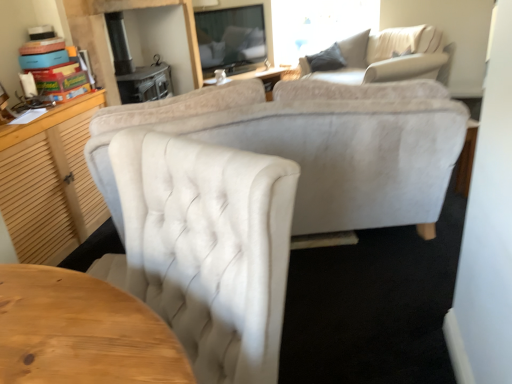
The image size is (512, 384). What do you see at coordinates (386, 56) in the screenshot?
I see `velvet beige sofa at upper right` at bounding box center [386, 56].

The image size is (512, 384). In order to click on velvet beige sofa at upper right in this screenshot , I will do `click(386, 56)`.

The height and width of the screenshot is (384, 512). What do you see at coordinates (206, 247) in the screenshot? I see `velvet white chair at center` at bounding box center [206, 247].

I want to click on velvet white chair at center, so pos(206,247).

Where is `velvet beige sofa at upper right`? This screenshot has width=512, height=384. velvet beige sofa at upper right is located at coordinates (386, 56).

Which is more to the left, velvet beige sofa at upper right or velvet white chair at center?

From the viewer's perspective, velvet white chair at center appears more on the left side.

From the picture: Does velvet beige sofa at upper right come in front of velvet white chair at center?

No, velvet beige sofa at upper right is further to the viewer.

Between point (349, 39) and point (268, 359), which one is positioned behind?

Positioned behind is point (349, 39).

From the image's perspective, which one is positioned higher, velvet beige sofa at upper right or velvet white chair at center?

velvet beige sofa at upper right is shown above in the image.

From a real-world perspective, between velvet beige sofa at upper right and velvet white chair at center, who is vertically higher?

velvet white chair at center.

Is velvet beige sofa at upper right thinner than velvet white chair at center?

No.

Can you confirm if velvet beige sofa at upper right is taller than velvet white chair at center?

In fact, velvet beige sofa at upper right may be shorter than velvet white chair at center.

Considering the sizes of velvet beige sofa at upper right and velvet white chair at center in the image, is velvet beige sofa at upper right bigger or smaller than velvet white chair at center?

In the image, velvet beige sofa at upper right appears to be larger than velvet white chair at center.

Would you say velvet beige sofa at upper right is outside velvet white chair at center?

Yes, velvet beige sofa at upper right is located beyond the bounds of velvet white chair at center.

Consider the image. Would you consider velvet beige sofa at upper right to be distant from velvet white chair at center?

velvet beige sofa at upper right is positioned a significant distance from velvet white chair at center.

Is velvet beige sofa at upper right oriented away from velvet white chair at center?

No.

How many degrees apart are the facing directions of velvet beige sofa at upper right and velvet white chair at center?

15.2 degrees separate the facing orientations of velvet beige sofa at upper right and velvet white chair at center.

I want to click on chair below the velvet beige sofa at upper right (from the image's perspective), so click(206, 247).

Does velvet white chair at center appear on the left side of velvet beige sofa at upper right?

Yes, velvet white chair at center is to the left of velvet beige sofa at upper right.

Between velvet white chair at center and velvet beige sofa at upper right, which one is positioned behind?

Positioned behind is velvet beige sofa at upper right.

Between point (188, 235) and point (370, 75), which one is positioned in front?

Point (188, 235)

From the image's perspective, which one is positioned lower, velvet white chair at center or velvet beige sofa at upper right?

velvet white chair at center, from the image's perspective.

From a real-world perspective, is velvet white chair at center physically located above or below velvet beige sofa at upper right?

velvet white chair at center is above velvet beige sofa at upper right.

Can you confirm if velvet white chair at center is wider than velvet beige sofa at upper right?

No.

Can you confirm if velvet white chair at center is shorter than velvet beige sofa at upper right?

In fact, velvet white chair at center may be taller than velvet beige sofa at upper right.

Which of these two, velvet white chair at center or velvet beige sofa at upper right, is smaller?

With smaller size is velvet white chair at center.

Is velvet white chair at center not inside velvet beige sofa at upper right?

velvet white chair at center lies outside velvet beige sofa at upper right's area.

Does velvet white chair at center touch velvet beige sofa at upper right?

A: No, velvet white chair at center is not next to velvet beige sofa at upper right.

Looking at this image, is velvet white chair at center facing towards velvet beige sofa at upper right?

No.

In order to click on studio couch located above the velvet white chair at center (from the image's perspective) in this screenshot , I will do `click(386, 56)`.

This screenshot has height=384, width=512. Identify the location of chair on the left of velvet beige sofa at upper right. (206, 247).

Locate an element on the screen. The height and width of the screenshot is (384, 512). chair in front of the velvet beige sofa at upper right is located at coordinates (206, 247).